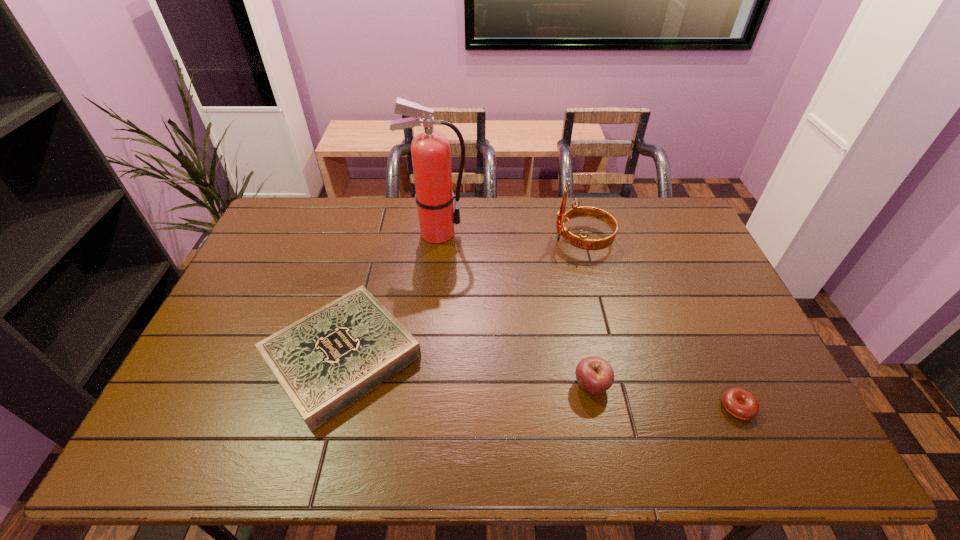
This screenshot has width=960, height=540. In the image, there is a desktop. In order to click on vacant space at the near edge in this screenshot , I will do `click(247, 440)`.

This screenshot has height=540, width=960. Identify the location of vacant space at the left edge. (214, 357).

The image size is (960, 540). In the image, there is a desktop. In order to click on free space at the right edge in this screenshot , I will do `click(703, 257)`.

The image size is (960, 540). Find the location of `blank space at the far left corner of the desktop`. blank space at the far left corner of the desktop is located at coordinates (310, 214).

In the image, there is a desktop. At what (x,y) coordinates should I click in order to perform the action: click on free space at the far right corner. Please return your answer as a coordinate pair (x, y). Image resolution: width=960 pixels, height=540 pixels. Looking at the image, I should click on (651, 225).

You are a GUI agent. You are given a task and a screenshot of the screen. Output one action in this format:
    pyautogui.click(x=<x>, y=<y>)
    Task: Click on the free space between the apple and the doughnut
    The height and width of the screenshot is (540, 960).
    Given the screenshot: What is the action you would take?
    pyautogui.click(x=664, y=396)

Where is `free space between the apple and the hardback book`? free space between the apple and the hardback book is located at coordinates (467, 371).

Image resolution: width=960 pixels, height=540 pixels. In order to click on vacant space in between the doughnut and the tallest object in this screenshot , I will do `click(587, 320)`.

Find the location of a particular element. Image resolution: width=960 pixels, height=540 pixels. empty space between the shortest object and the fire extinguisher is located at coordinates (587, 320).

The width and height of the screenshot is (960, 540). What are the coordinates of `empty location between the hardback book and the tiara` in the screenshot? It's located at (463, 298).